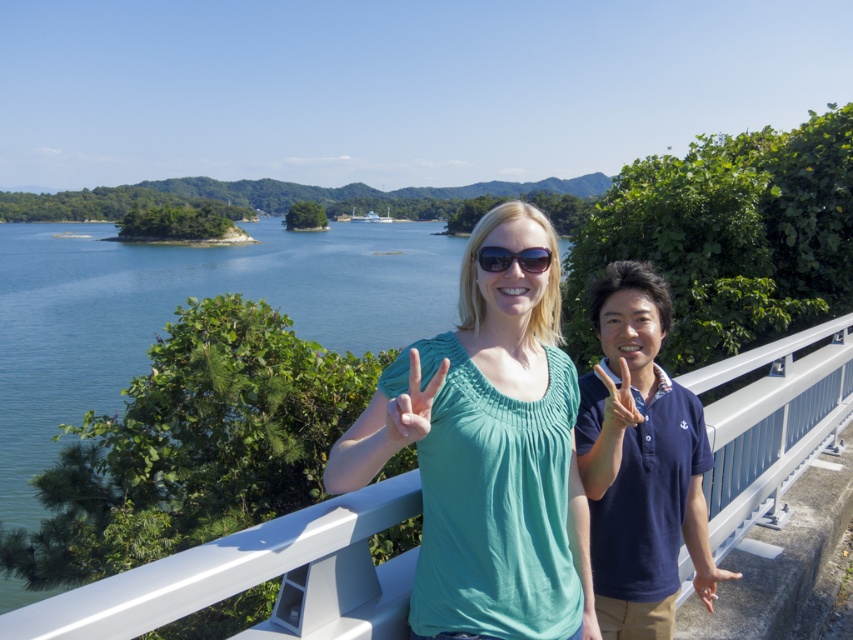
You are a photographer trying to capture the entire scene in one photo. The teal fabric shirt at center and the blue water at upper center are both in your frame. Considering their sizes, which object should you focus on to ensure both are clearly visible in the photo?

The teal fabric shirt at center has a smaller size compared to blue water at upper center, so focusing on the teal fabric shirt at center would help ensure both are clearly visible as it is smaller and might require more attention to detail.

You are a photographer trying to capture a candid shot of the two people on the white metal railing. You notice a green fabric hand at center marked by point (412, 404). Which person is making the peace sign with their green fabric hand at center?

The green fabric hand at center belongs to the person on the left wearing a teal sleeveless top, as the point indicates their hand position.